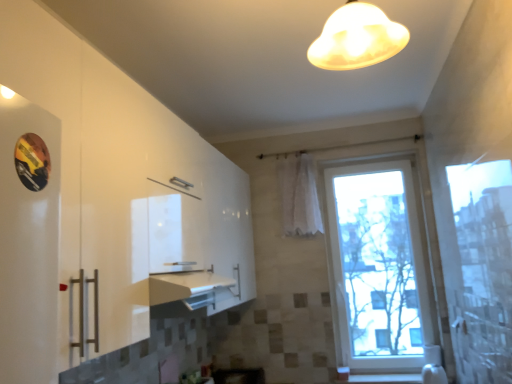
The image size is (512, 384). In order to click on empty space that is ontop of transparent glass window at center (from a real-world perspective) in this screenshot , I will do `click(365, 157)`.